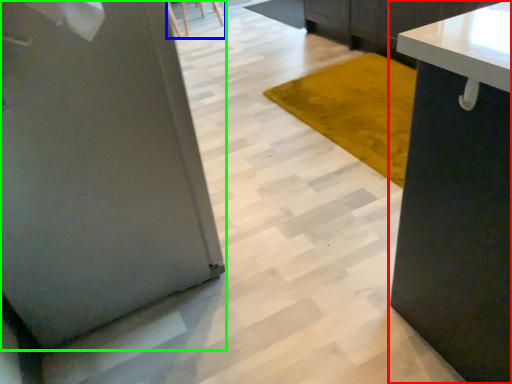
Question: Estimate the real-world distances between objects in this image. Which object is farther from cabinetry (highlighted by a red box), chair (highlighted by a blue box) or pillar (highlighted by a green box)?

Choices:
 (A) chair
 (B) pillar

Answer: (A)